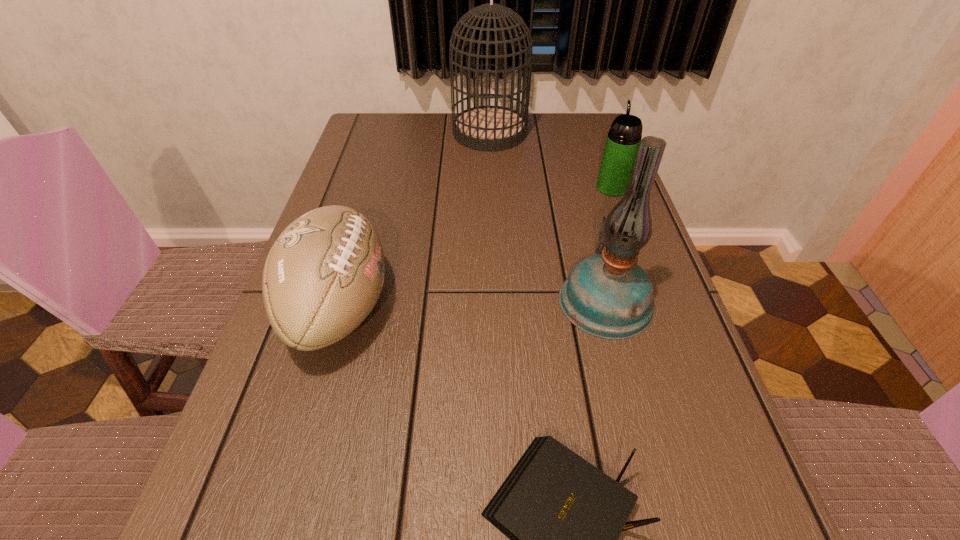
I want to click on vacant space located on the laces of the football (American), so click(x=530, y=308).

The width and height of the screenshot is (960, 540). I want to click on object that is positioned at the far edge, so click(x=484, y=128).

Locate an element on the screen. This screenshot has height=540, width=960. object located at the left edge is located at coordinates (324, 274).

Locate an element on the screen. The width and height of the screenshot is (960, 540). oil lamp that is positioned at the right edge is located at coordinates (608, 295).

I want to click on thermos bottle located at the right edge, so click(623, 140).

Identify the location of vacant point at the far edge. The image size is (960, 540). (436, 146).

In order to click on vacant space at the left edge in this screenshot , I will do tap(318, 430).

In the image, there is a desktop. Where is `vacant space at the right edge`? Image resolution: width=960 pixels, height=540 pixels. vacant space at the right edge is located at coordinates (595, 179).

Locate an element on the screen. free space at the far left corner of the desktop is located at coordinates [x=364, y=141].

Image resolution: width=960 pixels, height=540 pixels. Find the location of `vacant space at the far right corner of the desktop`. vacant space at the far right corner of the desktop is located at coordinates (599, 143).